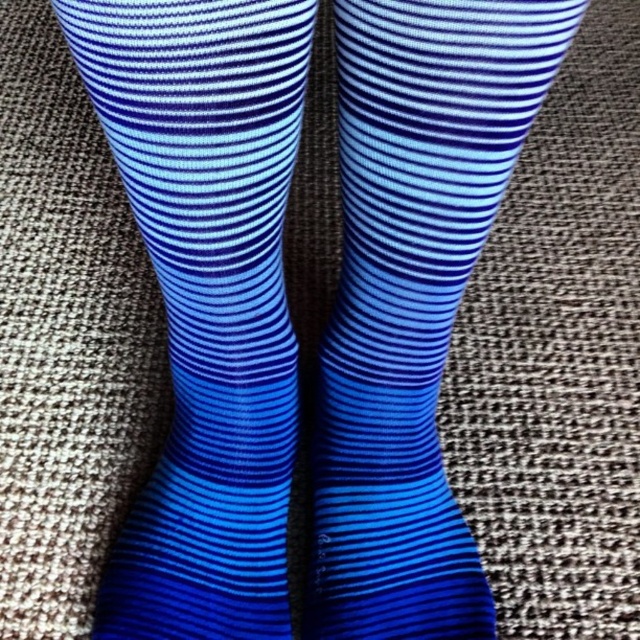
You are a photographer trying to capture a detailed shot of the blue striped sock at left. If your camera is positioned 50 centimeters away from the sock, will you need to move closer or farther away to focus properly?

The blue striped sock at left is currently 49.05 centimeters away from the camera. Since the camera is set to 50 centimeters, you need to move slightly farther away to match the focus distance.

You are trying to match the socks for a pair. You have the blue striped sock at left and the blue ribbed sock at center. Which sock is closer to your hand if your hand is at the center of the image?

The blue ribbed sock at center is closer to your hand since it is positioned at the center, whereas the blue striped sock at left is further away.

From the picture: You are a photographer trying to capture the blue striped sock at left and the blue ribbed sock at center. Which sock should you focus on first to ensure both are in sharp focus?

You should focus on the blue striped sock at left first since it is closer to the viewer than the blue ribbed sock at center, ensuring both will be in focus when using a shallow depth of field.